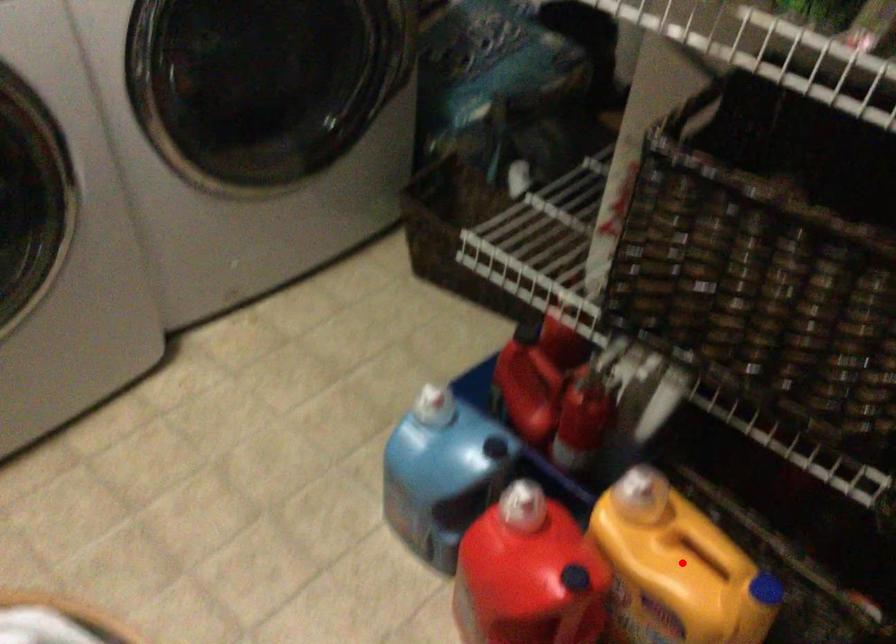
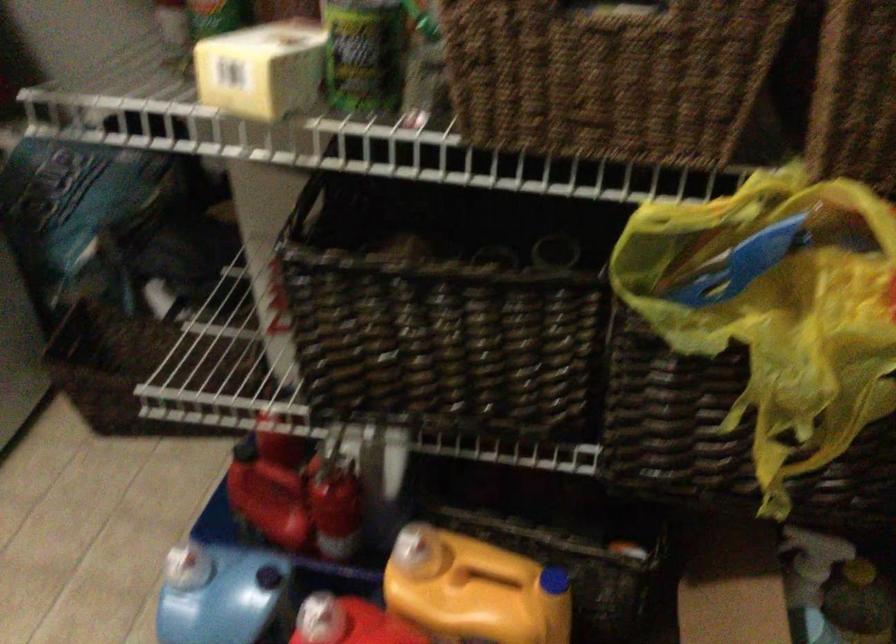
The point at the highlighted location is marked in the first image. Where is the corresponding point in the second image?

(474, 590)